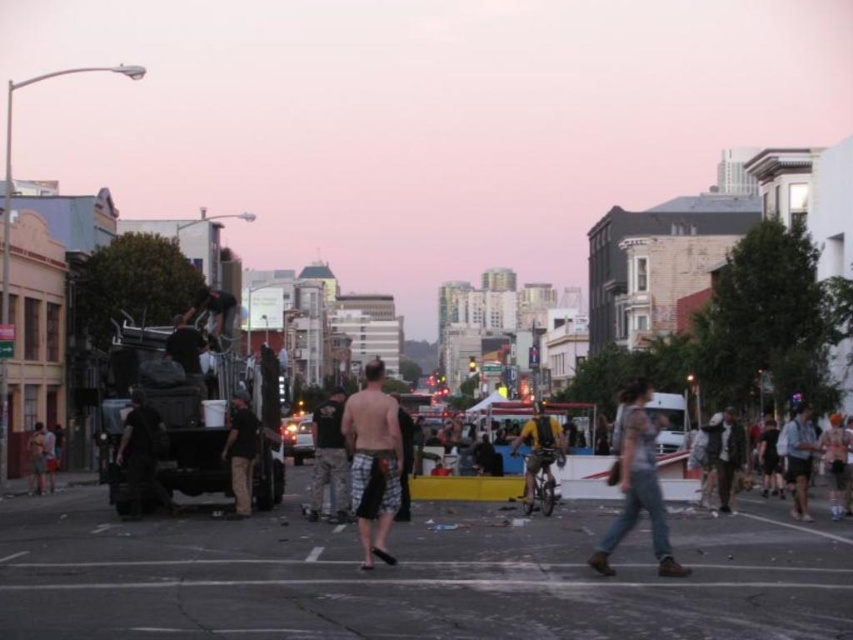
Which is more to the left, camouflage pants at center or yellow-green fabric backpack at center-right?

From the viewer's perspective, camouflage pants at center appears more on the left side.

Is point (343, 490) closer to viewer compared to point (531, 497)?

Yes, point (343, 490) is closer to viewer.

The width and height of the screenshot is (853, 640). In order to click on camouflage pants at center in this screenshot , I will do `click(329, 456)`.

Is plaid shorts at center positioned at the back of denim shorts at center?

That is True.

Is point (357, 436) positioned before point (641, 442)?

That is False.

This screenshot has width=853, height=640. Describe the element at coordinates (373, 461) in the screenshot. I see `plaid shorts at center` at that location.

You are a GUI agent. You are given a task and a screenshot of the screen. Output one action in this format:
    pyautogui.click(x=<x>, y=<y>)
    Task: Click on the plaid shorts at center
    This screenshot has width=853, height=640.
    Given the screenshot: What is the action you would take?
    pyautogui.click(x=373, y=461)

Can you confirm if denim shorts at center is positioned to the right of yellow-green fabric backpack at center-right?

Correct, you'll find denim shorts at center to the right of yellow-green fabric backpack at center-right.

Is point (625, 406) positioned in front of point (546, 458)?

That is True.

Does point (642, 500) come farther from viewer compared to point (538, 406)?

No, it is in front of (538, 406).

Find the location of `denim shorts at center`. denim shorts at center is located at coordinates tap(636, 483).